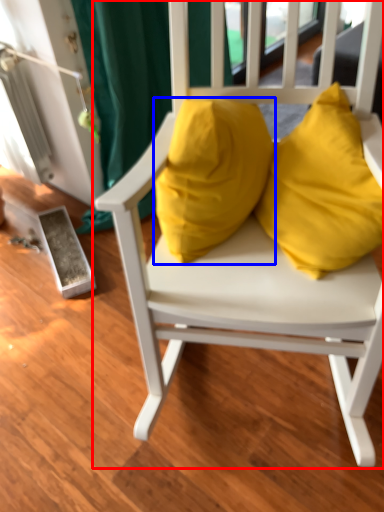
Question: Which point is further to the camera, chair (highlighted by a red box) or pillow (highlighted by a blue box)?

Choices:
 (A) chair
 (B) pillow

Answer: (B)